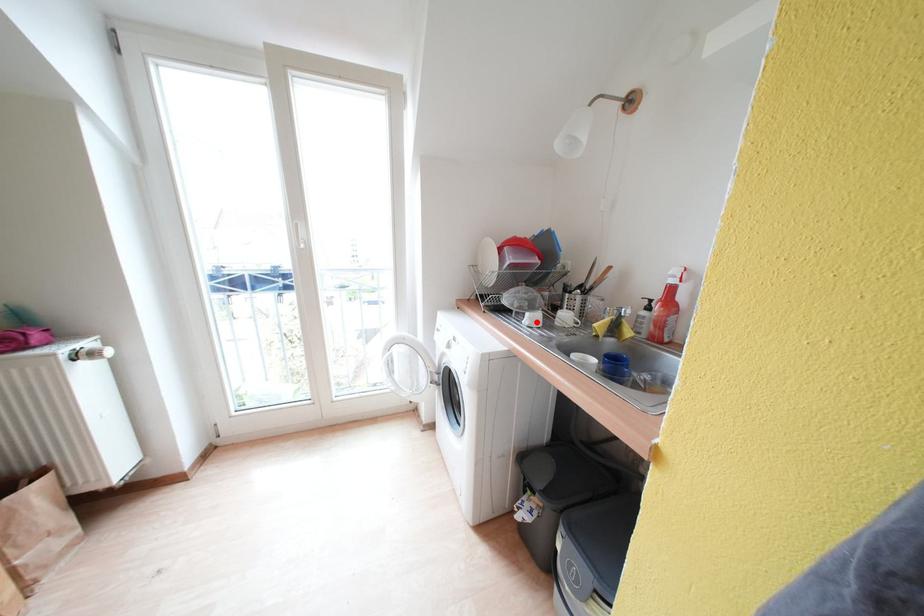
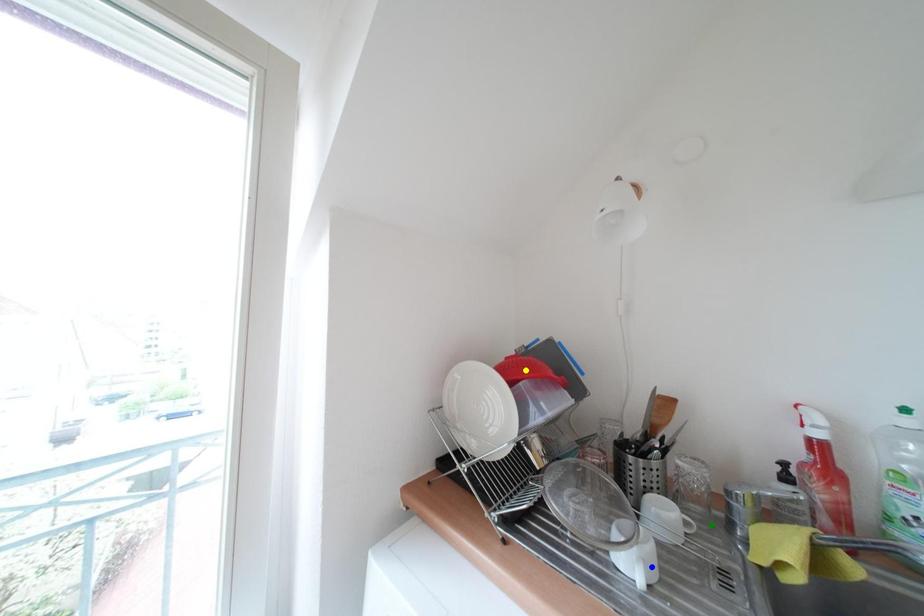
Question: I am providing you with two images of the same scene from different viewpoints. A red point is marked on the first image. You are given multiple points on the second image. Can you choose the point in image 2 that corresponds to the point in image 1?

Choices:
 (A) yellow point
 (B) green point
 (C) blue point

Answer: (C)